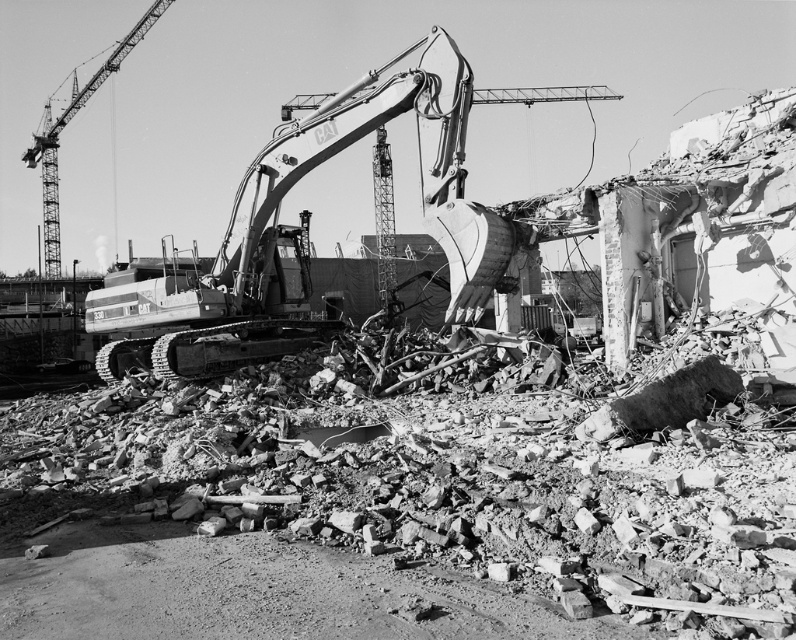
You are a construction worker standing at the edge of the construction site. You need to move a heavy object from the excavator to the crane. Which direction should you move the object to get it from the metallic gray excavator at center to the metallic gray crane at upper left?

You should move the object to the left, as the metallic gray excavator at center is positioned to the right of the metallic gray crane at upper left.

You are a construction worker who needs to move a 10m long beam from the demolished structure to the storage area. The path between the metallic gray excavator at center and the metallic gray crane at upper left is narrow. Can you pass through with the beam?

The metallic gray excavator at center is narrower than the metallic gray crane at upper left, so the path between them may be wide enough for the 10m beam to pass through.

You are a construction worker standing at the point with coordinates point (49,240) and need to reach point (184,356). Considering the debris scattered across the ground, which direction should you move to reach your destination?

You should move forward because point (184,356) is in front of point (49,240), so moving in that direction will lead you directly to your destination.